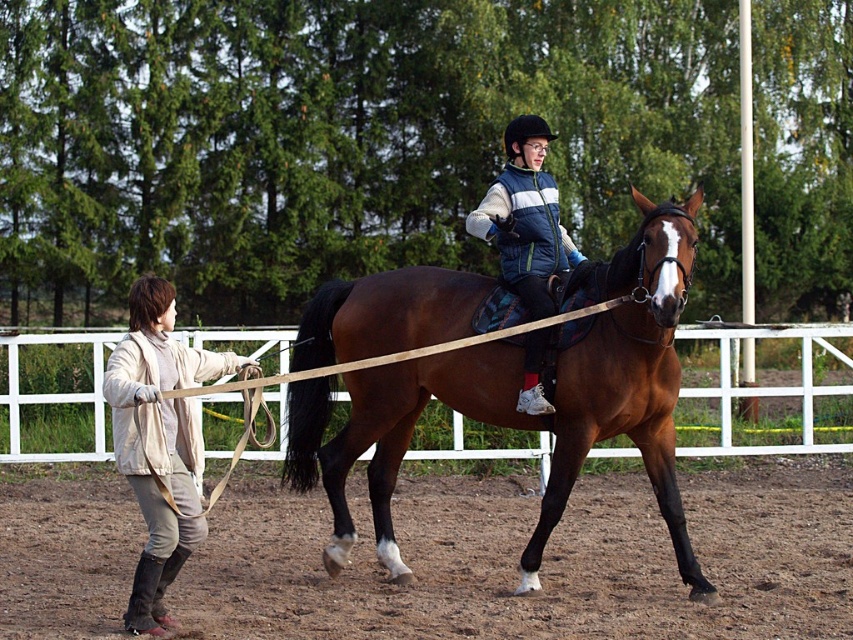
Question: Is brown dirt track at center wider than brown glossy horse at center?

Choices:
 (A) yes
 (B) no

Answer: (A)

Question: Which of the following is the closest to the observer?

Choices:
 (A) light beige fabric jacket at left
 (B) brown dirt track at center
 (C) brown glossy horse at center
 (D) blue padded vest at center

Answer: (A)

Question: Which of the following is the closest to the observer?

Choices:
 (A) (177, 532)
 (B) (438, 605)
 (C) (534, 314)
 (D) (602, 436)

Answer: (A)

Question: From the image, what is the correct spatial relationship of brown glossy horse at center in relation to blue padded vest at center?

Choices:
 (A) above
 (B) below

Answer: (B)

Question: Which is nearer to the light beige fabric jacket at left?

Choices:
 (A) brown glossy horse at center
 (B) brown dirt track at center
 (C) blue padded vest at center

Answer: (A)

Question: Can you confirm if brown glossy horse at center is positioned to the right of light beige fabric jacket at left?

Choices:
 (A) yes
 (B) no

Answer: (A)